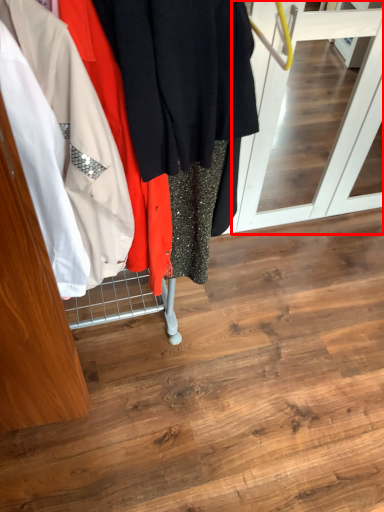
Question: Considering the relative positions of screen door (annotated by the red box) and closet in the image provided, where is screen door (annotated by the red box) located with respect to the staircase?

Choices:
 (A) left
 (B) right

Answer: (B)